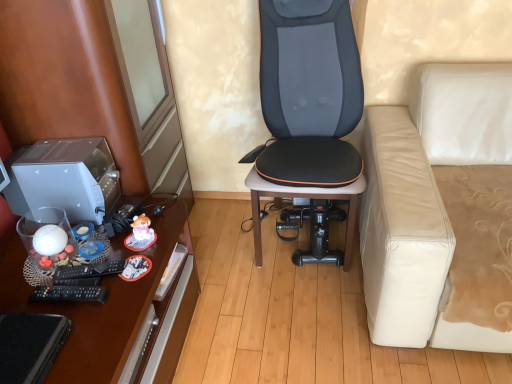
Question: From the image's perspective, relative to brown wood dresser at left, is satin silver desktop at left above or below?

Choices:
 (A) below
 (B) above

Answer: (A)

Question: Considering the positions of satin silver desktop at left and brown wood dresser at left in the image, is satin silver desktop at left bigger or smaller than brown wood dresser at left?

Choices:
 (A) small
 (B) big

Answer: (A)

Question: Estimate the real-world distances between objects in this image. Which object is farther from the satin silver desktop at left?

Choices:
 (A) white leather couch at right
 (B) brown wood dresser at left
 (C) brown wooden desk at left
 (D) black leather chair at center

Answer: (A)

Question: Estimate the real-world distances between objects in this image. Which object is closer to the brown wooden desk at left?

Choices:
 (A) black leather chair at center
 (B) satin silver desktop at left
 (C) white leather couch at right
 (D) brown wood dresser at left

Answer: (D)